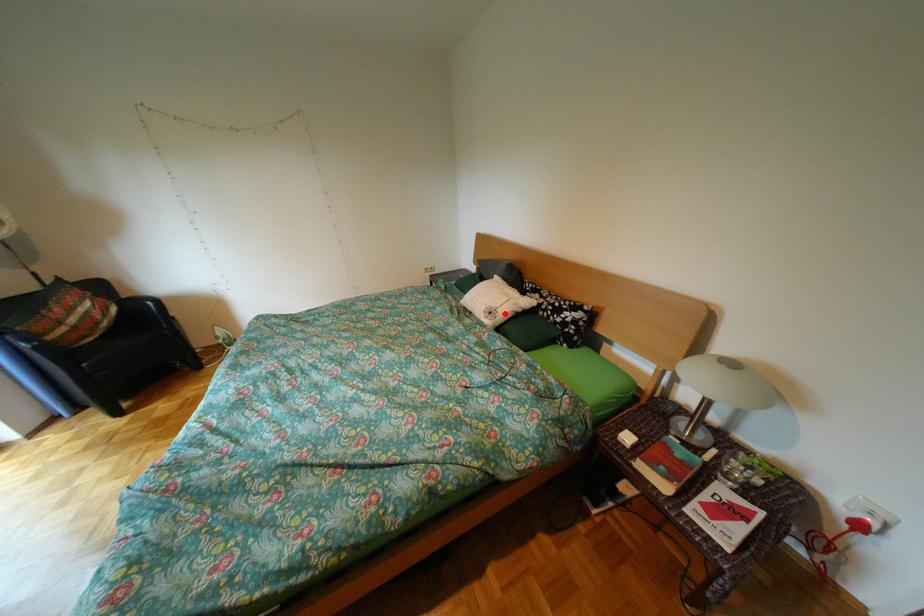
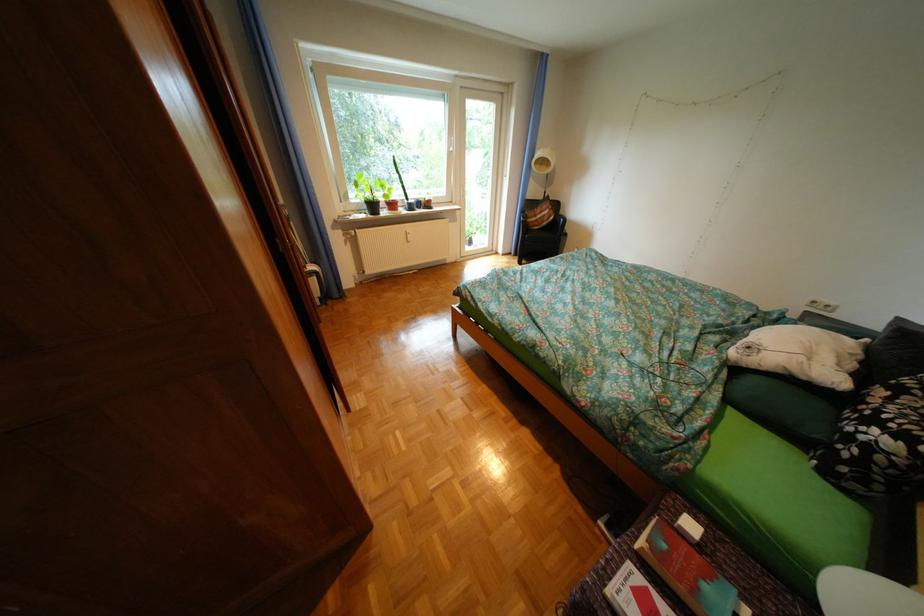
Locate, in the second image, the point that corresponds to the highlighted location in the first image.

(763, 349)